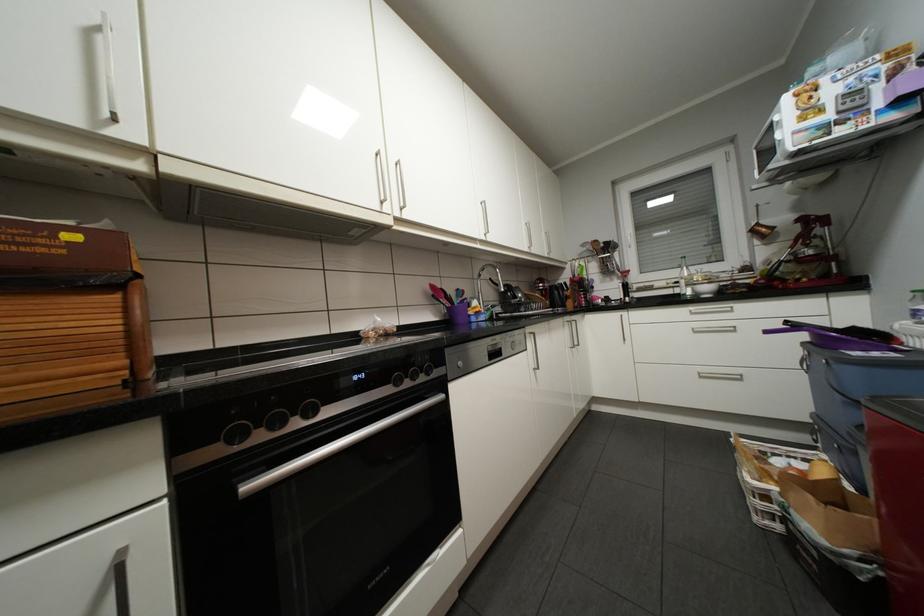
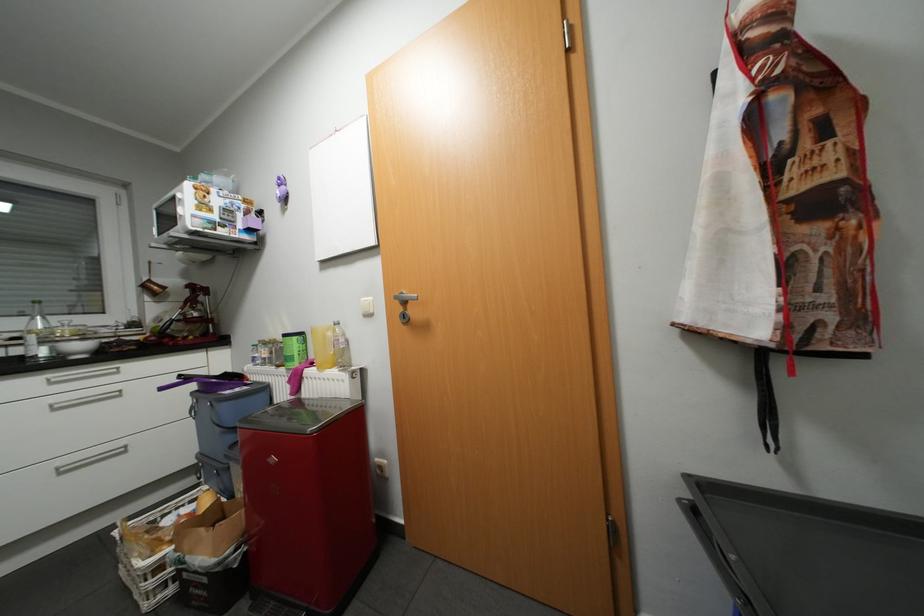
Locate, in the second image, the point that corresponds to point (847, 325) in the first image.

(225, 371)